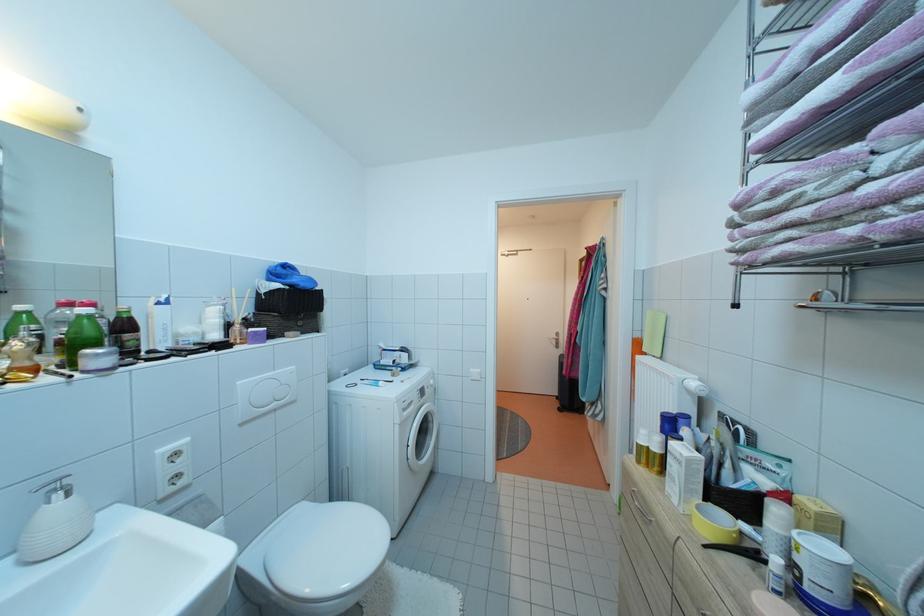
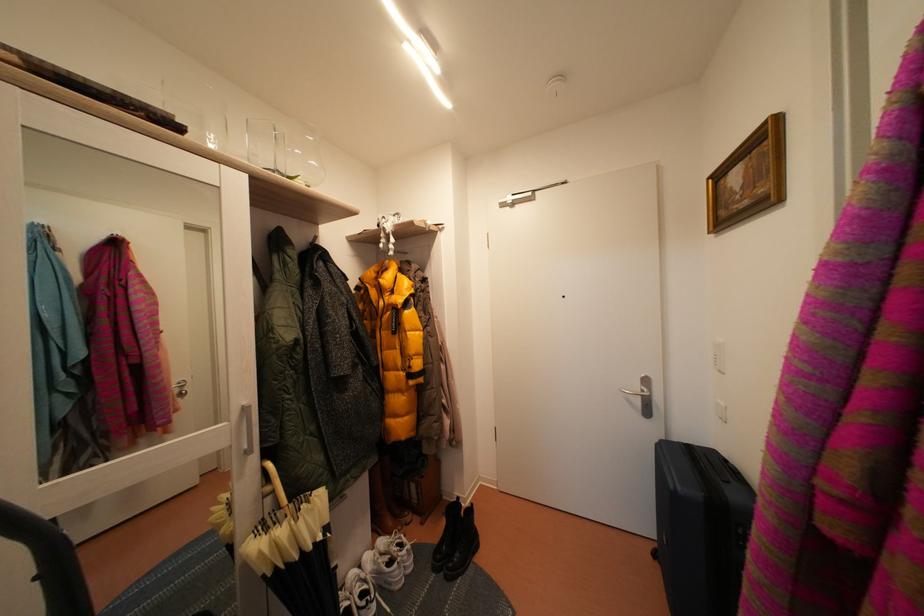
Find the pixel in the second image that matches pixel 562 342 in the first image.

(645, 392)